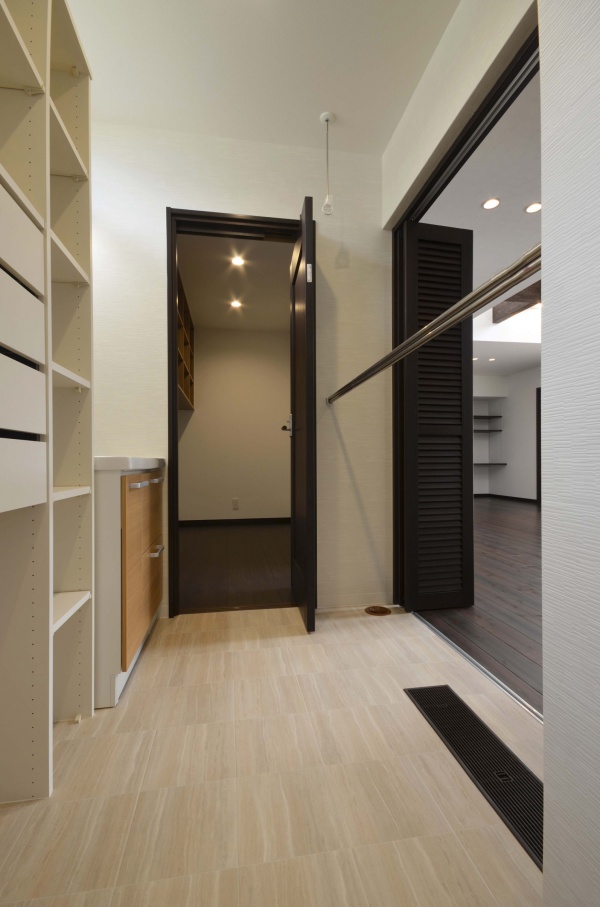
Where is `drawers`? This screenshot has width=600, height=907. drawers is located at coordinates (21, 239), (29, 482), (22, 414), (136, 513), (158, 511), (160, 580), (29, 318).